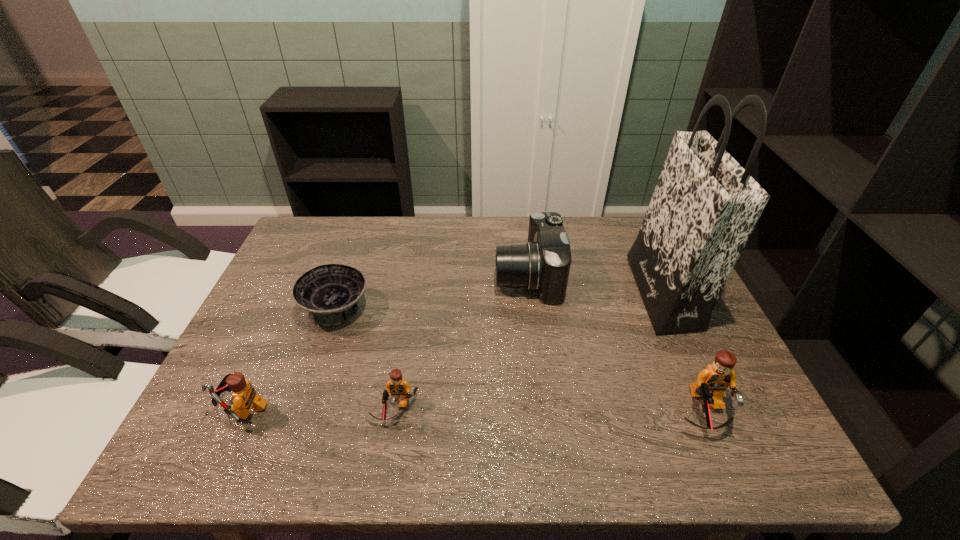
Where is `vacant region between the tallest object and the third shortest object`? vacant region between the tallest object and the third shortest object is located at coordinates (452, 350).

Identify the location of free space that is in between the second shortest Lego and the tallest Lego. (473, 411).

You are a GUI agent. You are given a task and a screenshot of the screen. Output one action in this format:
    pyautogui.click(x=<x>, y=<y>)
    Task: Click on the free space between the tallest object and the third object from right to left
    The height and width of the screenshot is (540, 960).
    Given the screenshot: What is the action you would take?
    pyautogui.click(x=595, y=285)

Locate an element on the screen. free space between the shopping bag and the bowl is located at coordinates (499, 301).

You are a GUI agent. You are given a task and a screenshot of the screen. Output one action in this format:
    pyautogui.click(x=<x>, y=<y>)
    Task: Click on the empty space between the bowl and the tallest object
    The height and width of the screenshot is (540, 960).
    Given the screenshot: What is the action you would take?
    pyautogui.click(x=499, y=301)

You are a GUI agent. You are given a task and a screenshot of the screen. Output one action in this format:
    pyautogui.click(x=<x>, y=<y>)
    Task: Click on the vacant space that's between the shortest Lego and the tallest object
    This screenshot has height=540, width=960.
    Given the screenshot: What is the action you would take?
    pyautogui.click(x=529, y=351)

Identify the location of free space between the rightmost Lego and the shopping bag. point(684,353).

You are a GUI agent. You are given a task and a screenshot of the screen. Output one action in this format:
    pyautogui.click(x=<x>, y=<y>)
    Task: Click on the free spot between the leftmost Lego and the fourth object from right to left
    The height and width of the screenshot is (540, 960).
    Given the screenshot: What is the action you would take?
    pyautogui.click(x=319, y=409)

This screenshot has height=540, width=960. I want to click on object that is the nearest to the fourth tallest object, so click(x=330, y=293).

The width and height of the screenshot is (960, 540). Find the location of `the closest object to the bowl`. the closest object to the bowl is located at coordinates (244, 396).